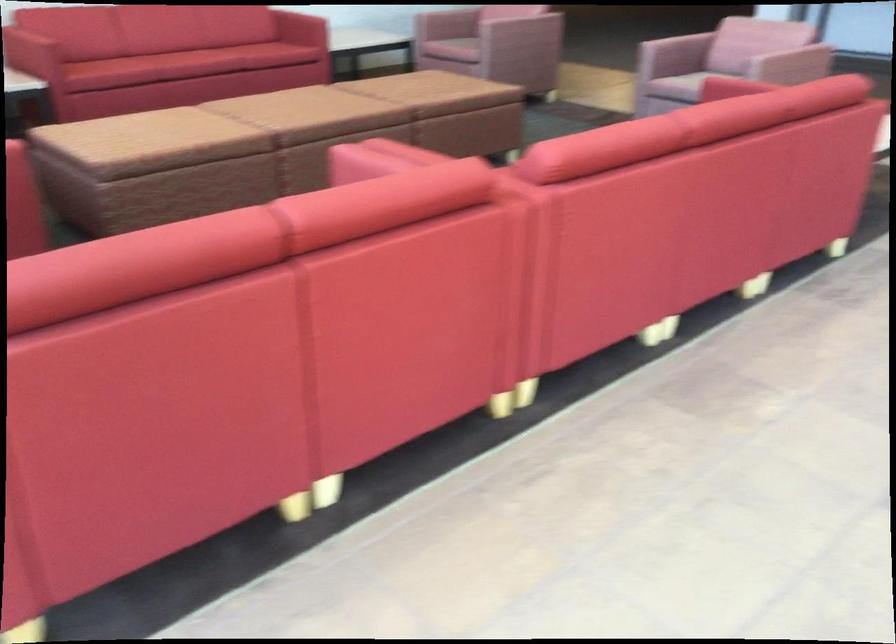
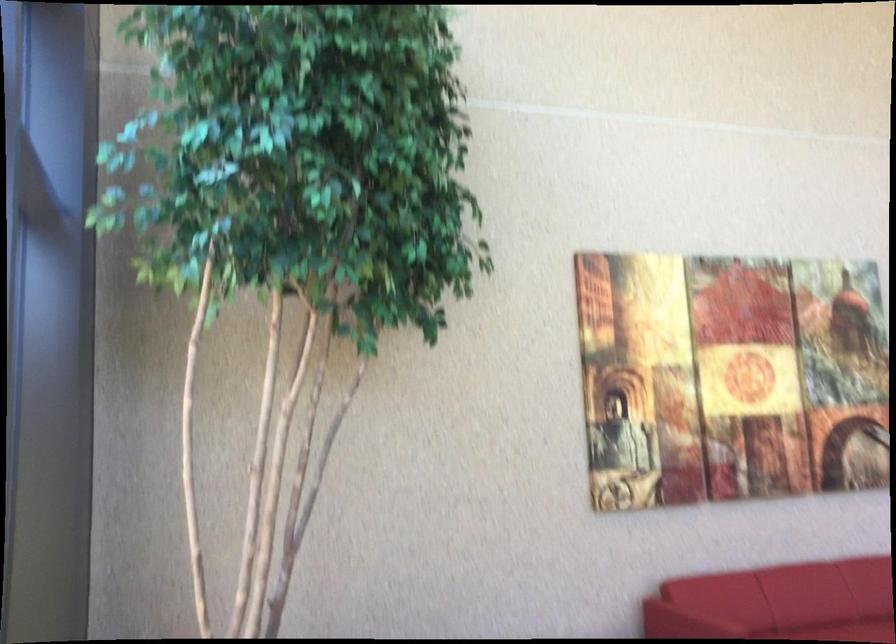
First-person continuous shooting, in which direction is the camera rotating?

The camera rotated toward right-down.